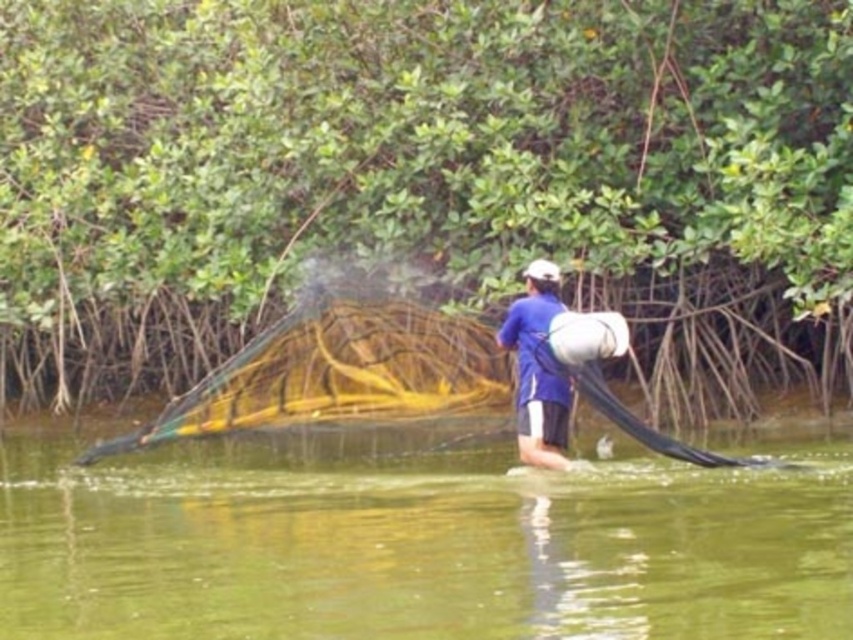
You are standing at the point marked as point (274, 138). The mangrove roots are located 15.43 meters away from you. Can you see the mangrove roots clearly from your current position?

Yes, the mangrove roots are 15.43 meters away from the point (274, 138), so they can be seen clearly from that position.

You are a drone operator trying to capture a photo of the person fishing. The drone is currently at the point with coordinates 0.6, 0.5. The green translucent water at center is at 0.847, 0.495. To avoid the water in the shot, should you move the drone north or south?

The green translucent water at center is located at point (421, 541). The drone is at (426, 384). Since the water is to the east of the drone, moving north or south won